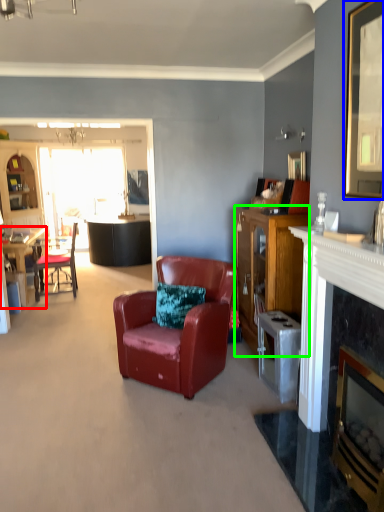
Question: Which object is the closest to the desk (highlighted by a red box)? Choose among these: picture frame (highlighted by a blue box) or cabinetry (highlighted by a green box).

Choices:
 (A) picture frame
 (B) cabinetry

Answer: (B)